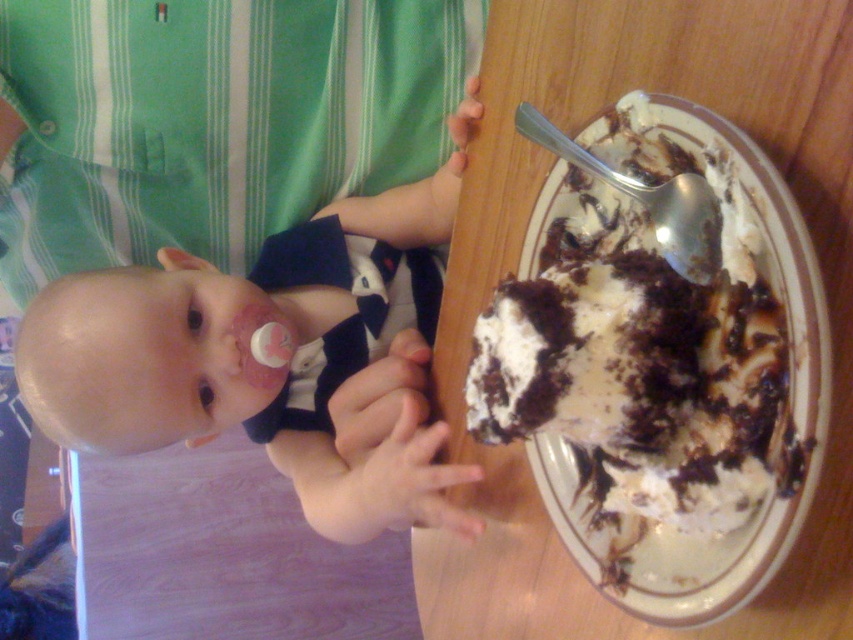
You are a parent trying to clean up after your baby. You see the pink pacifier at left and the white glazed porcelain at right on the table. Which item should you pick up first if you want to start cleaning from the left side of the table?

You should pick up the pink pacifier at left first because it is located to the left of the white glazed porcelain at right, making it closer to the left side of the table.

You are a parent trying to clean up after your baby. You see the pink pacifier at left and the white glazed porcelain at right. Which item is closer to you?

The pink pacifier at left is closer to you since it is 11.21 inches away from the white glazed porcelain at right.

You are a photographer taking a closeup shot of the baby. The pink pacifier at left is in the frame. To ensure the pacifier stays in the shot, where should you position your camera relative to the baby?

The pink pacifier at left is located at point (263, 360), so you should position your camera so that the pacifier remains within the frame by keeping the camera angle focused on that coordinate.